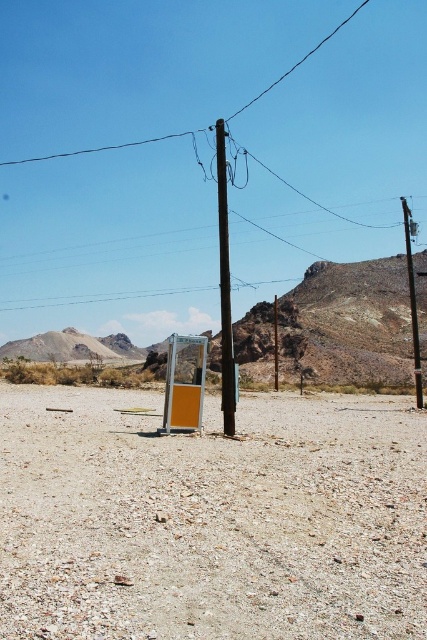
You are a construction worker planning to place a 1.5 meter wide equipment on the gray gravelly dirt at center. The smooth wood telegraph pole at right is nearby. Can the equipment be placed there without touching the pole?

The gray gravelly dirt at center is thinner than the smooth wood telegraph pole at right. Since the dirt area is narrower, placing a 1.5 meter wide equipment might risk touching the pole. Check the exact dimensions before deciding.

You are standing at the point marked by the coordinates point at (166, 381). You want to walk to the utility pole that is closer to the vintage payphone booth. Which utility pole should you head towards?

The utility pole closer to the vintage payphone booth is the one at the center, so you should head towards the center utility pole.

You are a hiker trying to determine the elevation changes in this area. Given the gray gravelly dirt at center and the smooth wood telegraph pole at right, which one is lower in elevation?

The gray gravelly dirt at center is lower in elevation than the smooth wood telegraph pole at right because it is shorter.